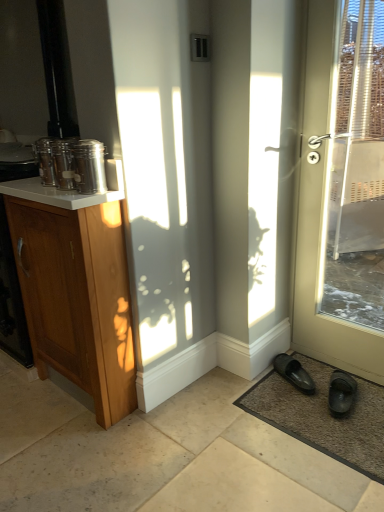
Question: Is black rubber slipper at lower right, the 1th footwear when ordered from left to right, smaller than black rubber slippers at lower right, which appears as the 1th footwear when viewed from the right?

Choices:
 (A) no
 (B) yes

Answer: (B)

Question: From a real-world perspective, is black rubber slipper at lower right, the second footwear viewed from the right, positioned over black rubber slippers at lower right, marked as the second footwear in a left-to-right arrangement, based on gravity?

Choices:
 (A) no
 (B) yes

Answer: (A)

Question: Does black rubber slipper at lower right, the 1th footwear when ordered from left to right, touch black rubber slippers at lower right, which appears as the 1th footwear when viewed from the right?

Choices:
 (A) no
 (B) yes

Answer: (A)

Question: From the image's perspective, is black rubber slipper at lower right, the second footwear viewed from the right, located beneath black rubber slippers at lower right, marked as the second footwear in a left-to-right arrangement?

Choices:
 (A) yes
 (B) no

Answer: (B)

Question: Can you confirm if black rubber slipper at lower right, the 1th footwear when ordered from left to right, is thinner than black rubber slippers at lower right, marked as the second footwear in a left-to-right arrangement?

Choices:
 (A) yes
 (B) no

Answer: (A)

Question: Does black rubber slipper at lower right, the second footwear viewed from the right, come in front of black rubber slippers at lower right, marked as the second footwear in a left-to-right arrangement?

Choices:
 (A) no
 (B) yes

Answer: (A)

Question: Considering the relative sizes of brown textured mat at lower right and brushed metal canister at upper left in the image provided, is brown textured mat at lower right smaller than brushed metal canister at upper left?

Choices:
 (A) yes
 (B) no

Answer: (B)

Question: Is brown textured mat at lower right aimed at brushed metal canister at upper left?

Choices:
 (A) yes
 (B) no

Answer: (B)

Question: Can you see brown textured mat at lower right touching brushed metal canister at upper left?

Choices:
 (A) yes
 (B) no

Answer: (B)

Question: Is brown textured mat at lower right oriented away from brushed metal canister at upper left?

Choices:
 (A) yes
 (B) no

Answer: (B)

Question: Considering the relative sizes of brown textured mat at lower right and brushed metal canister at upper left in the image provided, is brown textured mat at lower right taller than brushed metal canister at upper left?

Choices:
 (A) no
 (B) yes

Answer: (A)

Question: From the image's perspective, is brown textured mat at lower right beneath brushed metal canister at upper left?

Choices:
 (A) no
 (B) yes

Answer: (B)

Question: Is white glossy counter top at upper left positioned behind wooden cabinet at left?

Choices:
 (A) yes
 (B) no

Answer: (B)